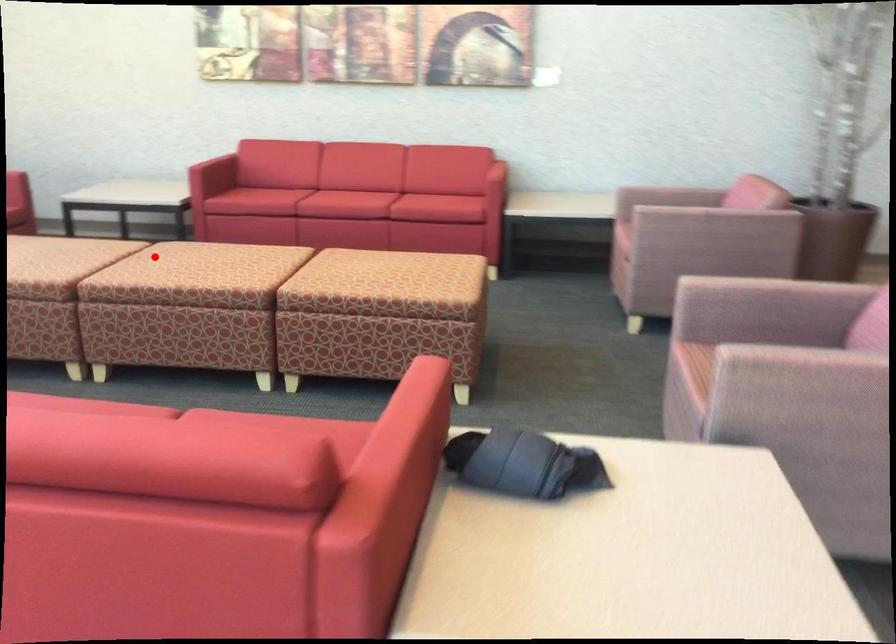
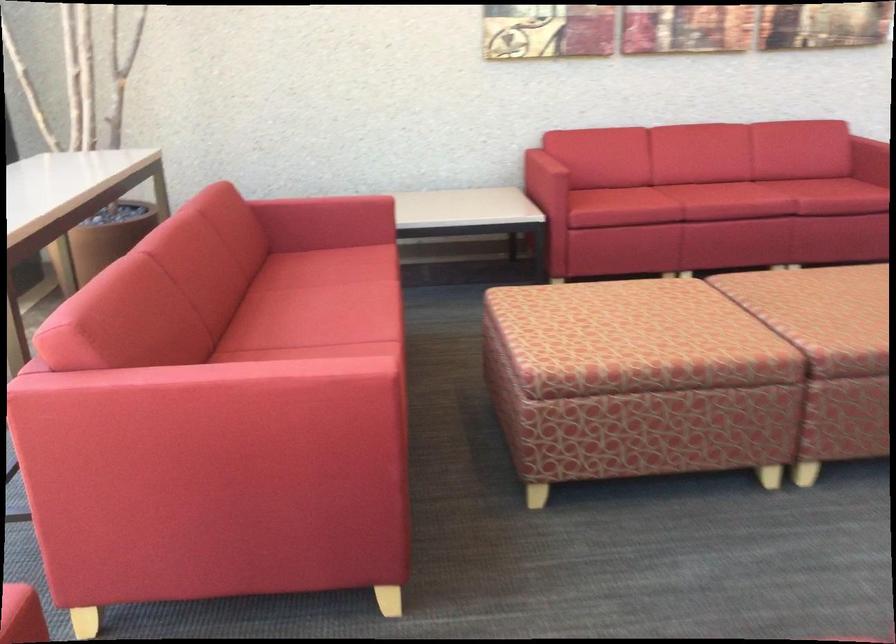
The point at the highlighted location is marked in the first image. Where is the corresponding point in the second image?

(834, 317)